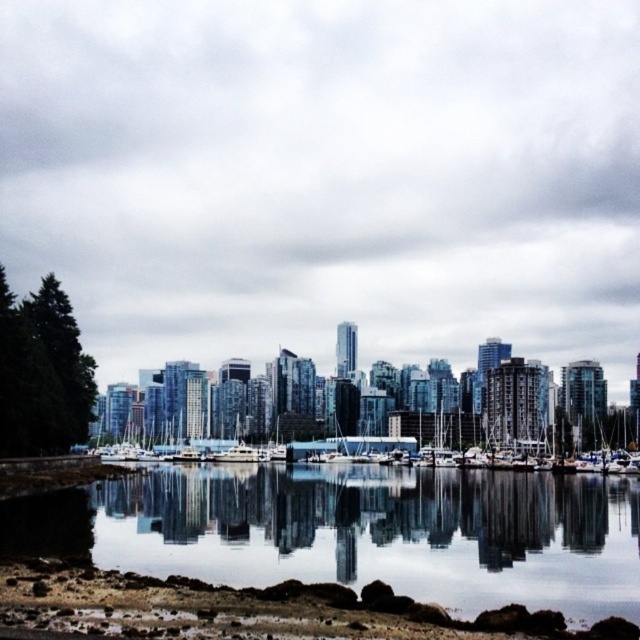
Can you confirm if transparent glass skyscrapers at center is thinner than clear water at lower left?

No, transparent glass skyscrapers at center is not thinner than clear water at lower left.

Which of these two, transparent glass skyscrapers at center or clear water at lower left, stands taller?

transparent glass skyscrapers at center

Does point (28, 259) come farther from viewer compared to point (333, 522)?

Yes, it is.

Identify the location of transparent glass skyscrapers at center. (326, 177).

Which of these two, clear water at lower left or white glossy boats at center, stands taller?

white glossy boats at center is taller.

Is clear water at lower left closer to camera compared to white glossy boats at center?

Yes, clear water at lower left is in front of white glossy boats at center.

Between point (104, 483) and point (508, 458), which one is positioned behind?

Point (508, 458)

Where is `clear water at lower left`? This screenshot has width=640, height=640. clear water at lower left is located at coordinates (381, 532).

Does transparent glass skyscrapers at center have a lesser height compared to bare soil at lower center?

No, transparent glass skyscrapers at center is not shorter than bare soil at lower center.

The width and height of the screenshot is (640, 640). What do you see at coordinates (326, 177) in the screenshot? I see `transparent glass skyscrapers at center` at bounding box center [326, 177].

Image resolution: width=640 pixels, height=640 pixels. What are the coordinates of `transparent glass skyscrapers at center` in the screenshot? It's located at (326, 177).